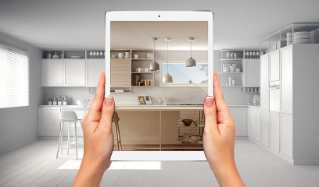
Where is `chair`? This screenshot has width=319, height=187. chair is located at coordinates (118, 118).